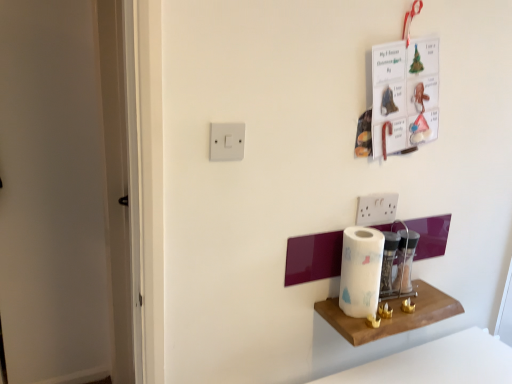
You are a GUI agent. You are given a task and a screenshot of the screen. Output one action in this format:
    pyautogui.click(x=<x>, y=<y>)
    Task: Click on the unoccupied region to the right of white paper at center
    The image size is (512, 384).
    Given the screenshot: What is the action you would take?
    pyautogui.click(x=402, y=304)